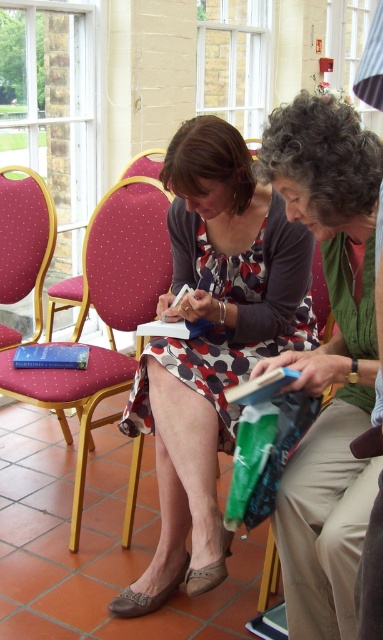
Who is lower down, green knitted sweater at center or blue hardcover book at center?

blue hardcover book at center

From the picture: Who is more forward, (301, 387) or (54, 356)?

Positioned in front is point (301, 387).

Is point (307, 616) farther from camera compared to point (70, 365)?

No, (307, 616) is in front of (70, 365).

The image size is (383, 640). What are the coordinates of `green knitted sweater at center` in the screenshot? It's located at (327, 358).

Between green knitted sweater at center and matte pink fabric armchair at left, which one has less height?

Standing shorter between the two is green knitted sweater at center.

Does point (328, 632) lie in front of point (93, 406)?

Yes, it is in front of point (93, 406).

You are a GUI agent. You are given a task and a screenshot of the screen. Output one action in this format:
    pyautogui.click(x=<x>, y=<y>)
    Task: Click on the green knitted sweater at center
    This screenshot has height=640, width=383.
    Given the screenshot: What is the action you would take?
    pyautogui.click(x=327, y=358)

Can you confirm if polka dot dress at center is positioned to the right of green knitted sweater at center?

Incorrect, polka dot dress at center is not on the right side of green knitted sweater at center.

What do you see at coordinates (211, 342) in the screenshot?
I see `polka dot dress at center` at bounding box center [211, 342].

Identify the location of polka dot dress at center. This screenshot has width=383, height=640. (211, 342).